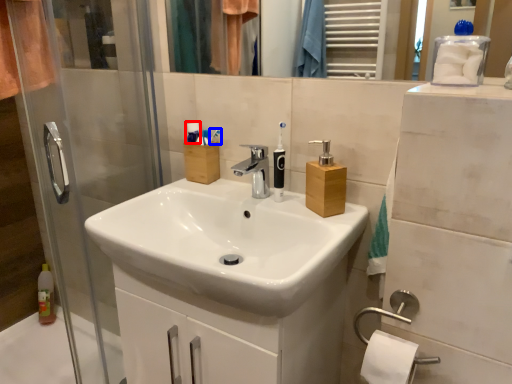
Question: Which point is closer to the camera, toiletry (highlighted by a red box) or toothbrush (highlighted by a blue box)?

Choices:
 (A) toiletry
 (B) toothbrush

Answer: (B)